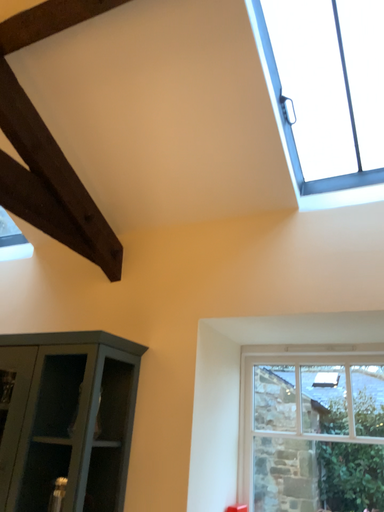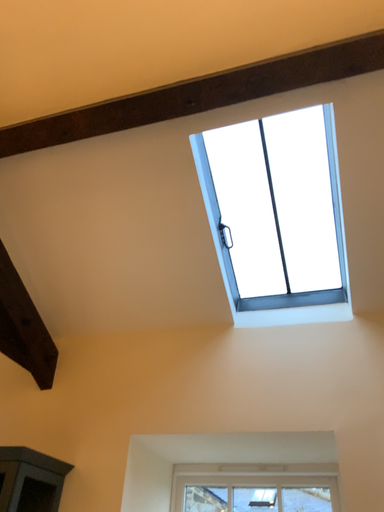
Question: How did the camera likely rotate when shooting the video?

Choices:
 (A) rotated downward
 (B) rotated upward

Answer: (B)